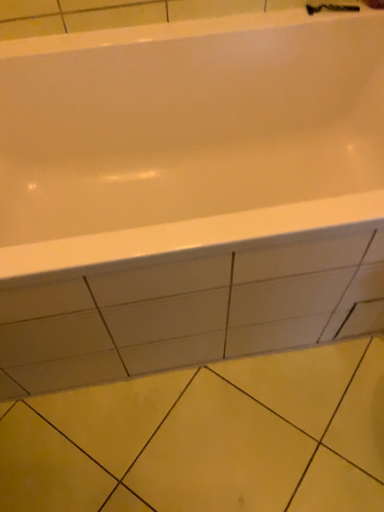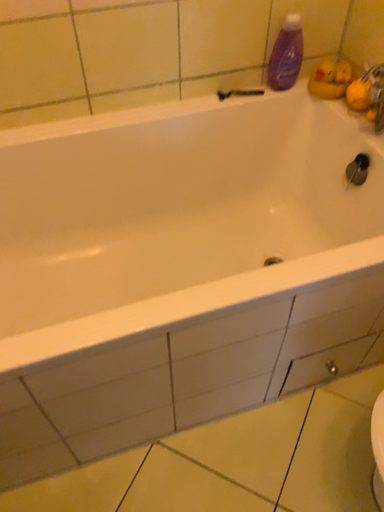
Question: Which way did the camera rotate in the video?

Choices:
 (A) rotated downward
 (B) rotated upward

Answer: (B)